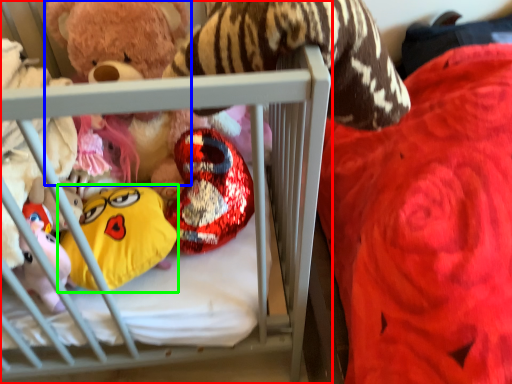
Question: Which is farther away from infant bed (highlighted by a red box)? toy (highlighted by a blue box) or toy (highlighted by a green box)?

Choices:
 (A) toy
 (B) toy

Answer: (A)